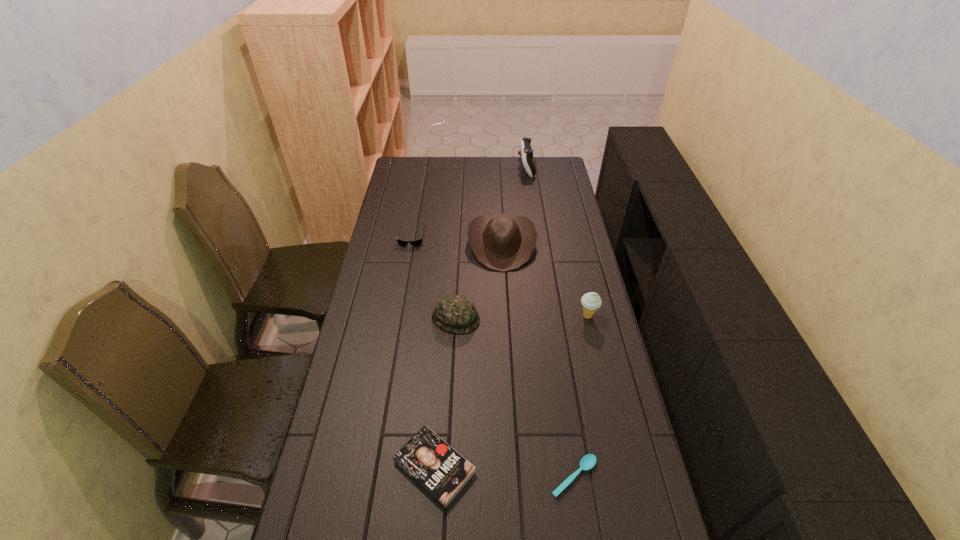
Identify the location of vacant space that satisfies the following two spatial constraints: 1. on the front-facing side of the spoon; 2. on the left side of the leftmost object. This screenshot has width=960, height=540. (369, 477).

You are a GUI agent. You are given a task and a screenshot of the screen. Output one action in this format:
    pyautogui.click(x=<x>, y=<y>)
    Task: Click on the free region that satisfies the following two spatial constraints: 1. on the front-facing side of the sunglasses; 2. on the left side of the shortest object
    This screenshot has width=960, height=540.
    Given the screenshot: What is the action you would take?
    pyautogui.click(x=369, y=477)

This screenshot has height=540, width=960. I want to click on vacant position in the image that satisfies the following two spatial constraints: 1. on the front side of the fourth shortest object; 2. on the left side of the shortest object, so click(447, 477).